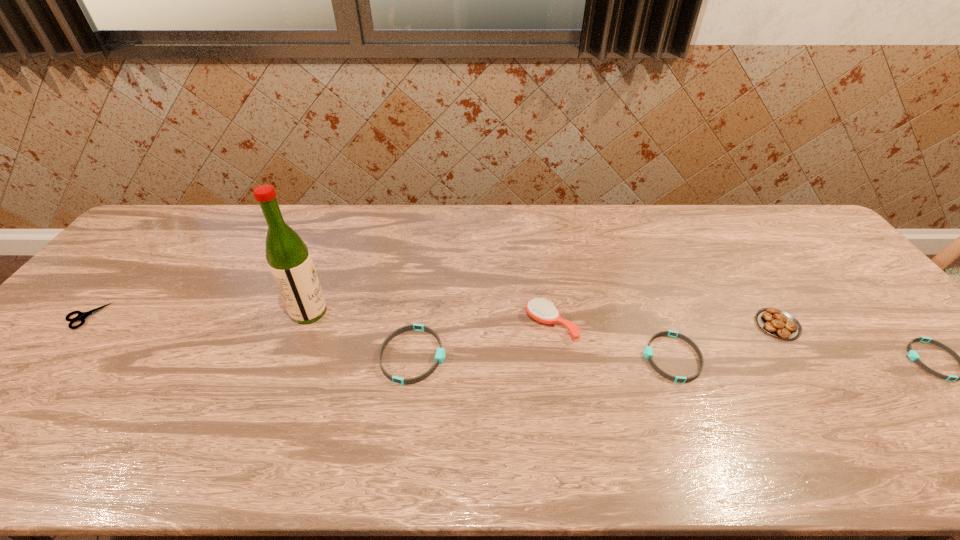
The image size is (960, 540). I want to click on vacant space at the far edge, so pyautogui.click(x=455, y=232).

The width and height of the screenshot is (960, 540). What are the coordinates of `free space at the near edge` in the screenshot? It's located at (414, 402).

Image resolution: width=960 pixels, height=540 pixels. In the image, there is a desktop. In order to click on vacant space at the left edge in this screenshot , I will do `click(148, 278)`.

Find the location of a particular element. The height and width of the screenshot is (540, 960). free point at the right edge is located at coordinates (818, 278).

Locate an element on the screen. This screenshot has height=540, width=960. vacant space at the far left corner of the desktop is located at coordinates (202, 208).

The width and height of the screenshot is (960, 540). Find the location of `vacant point located between the fifth object from right to left and the shortest object`. vacant point located between the fifth object from right to left and the shortest object is located at coordinates (250, 336).

You are a GUI agent. You are given a task and a screenshot of the screen. Output one action in this format:
    pyautogui.click(x=<x>, y=<y>)
    Task: Click on the empty space that is in between the fourth object from right to left and the fifth object from left to right
    
    Given the screenshot: What is the action you would take?
    pyautogui.click(x=612, y=341)

This screenshot has height=540, width=960. In order to click on free space between the pastry and the shears in this screenshot , I will do `click(432, 320)`.

Image resolution: width=960 pixels, height=540 pixels. I want to click on vacant region between the leftmost object and the sixth object from right to left, so (198, 314).

Where is `free space between the fifth object from right to left and the shears`? Image resolution: width=960 pixels, height=540 pixels. free space between the fifth object from right to left and the shears is located at coordinates (250, 336).